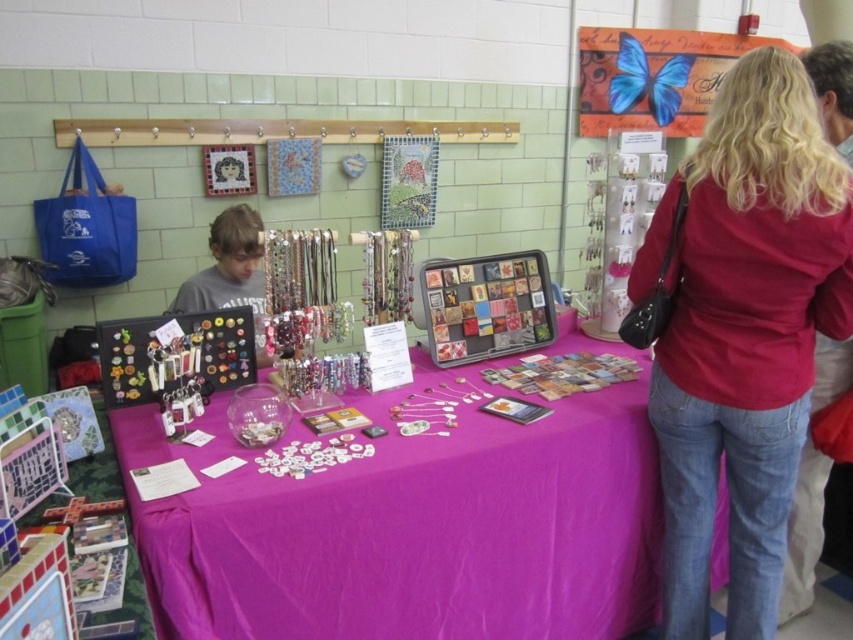
Based on the photo, is purple fabric tablecloth at center below matte blue butterfly at upper right?

Indeed, purple fabric tablecloth at center is positioned under matte blue butterfly at upper right.

This screenshot has width=853, height=640. Identify the location of purple fabric tablecloth at center. (415, 529).

Between matte red shirt at center and matte blue butterfly at upper right, which one appears on the left side from the viewer's perspective?

From the viewer's perspective, matte red shirt at center appears more on the left side.

I want to click on matte red shirt at center, so click(x=743, y=333).

Is point (228, 474) less distant than point (772, 580)?

Yes, it is.

Based on the photo, can you confirm if purple fabric tablecloth at center is positioned above matte red shirt at center?

No, purple fabric tablecloth at center is not above matte red shirt at center.

Is point (306, 573) positioned behind point (730, 288)?

No.

At what (x,y) coordinates should I click in order to perform the action: click on purple fabric tablecloth at center. Please return your answer as a coordinate pair (x, y). Image resolution: width=853 pixels, height=640 pixels. Looking at the image, I should click on (415, 529).